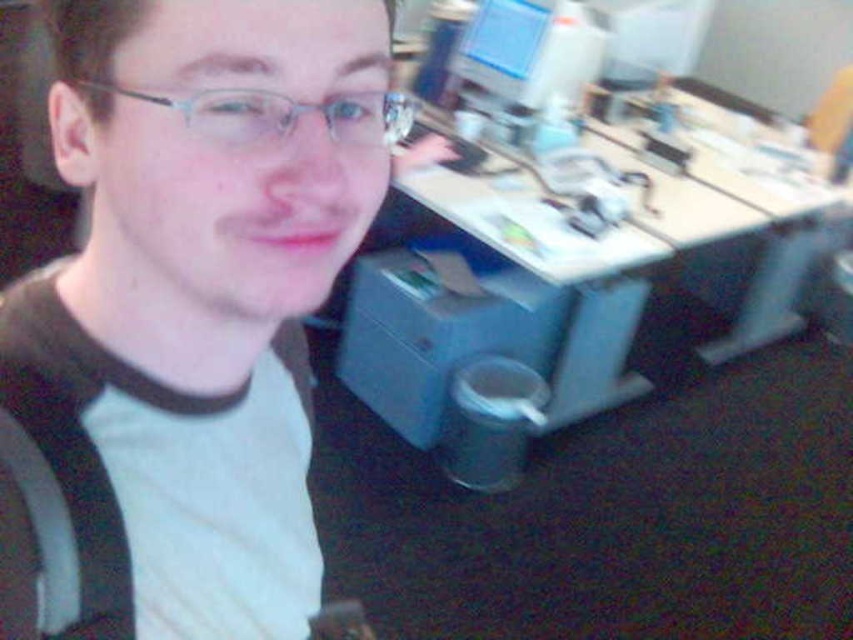
Question: Which of the following is the farthest from the observer?

Choices:
 (A) (405, 134)
 (B) (679, 333)

Answer: (B)

Question: Is blue plastic computer desk at center bigger than clear plastic glasses at upper center?

Choices:
 (A) no
 (B) yes

Answer: (B)

Question: Is matte black shirt at center wider than blue plastic computer desk at center?

Choices:
 (A) yes
 (B) no

Answer: (B)

Question: Which object is positioned closest to the clear plastic glasses at upper center?

Choices:
 (A) blue plastic computer desk at center
 (B) matte black shirt at center

Answer: (B)

Question: Is matte black shirt at center closer to the viewer compared to clear plastic glasses at upper center?

Choices:
 (A) no
 (B) yes

Answer: (B)

Question: Which point is closer to the camera?

Choices:
 (A) blue plastic computer desk at center
 (B) matte black shirt at center

Answer: (B)